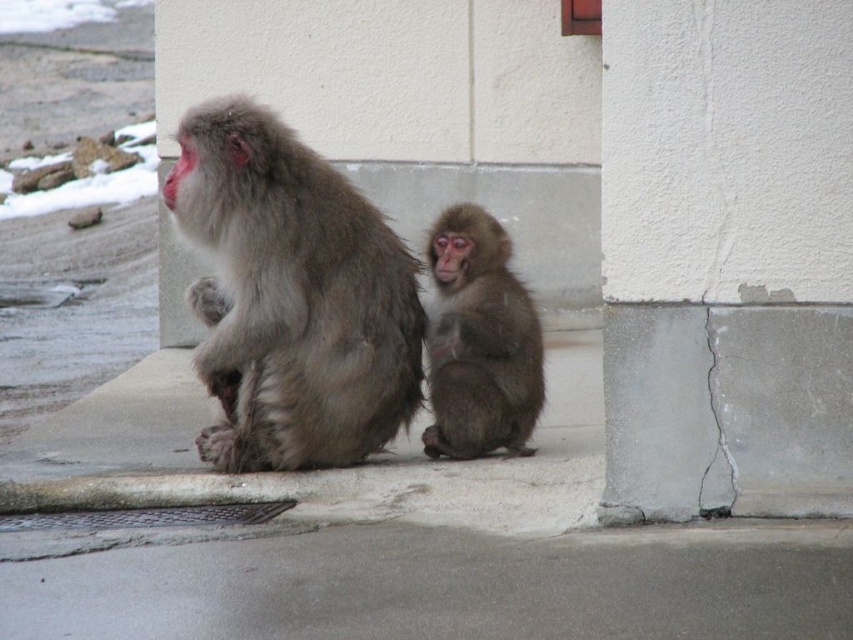
Is fuzzy gray fur monkey at center shorter than fuzzy brown monkey at center?

No.

Is fuzzy gray fur monkey at center bigger than fuzzy brown monkey at center?

Yes.

Who is more forward, [329,230] or [434,328]?

Positioned in front is point [329,230].

At what (x,y) coordinates should I click in order to perform the action: click on fuzzy gray fur monkey at center. Please return your answer as a coordinate pair (x, y). This screenshot has height=640, width=853. Looking at the image, I should click on (292, 296).

Consider the image. Does white concrete pillar at lower right lie behind fuzzy gray fur monkey at center?

That is False.

Is the position of white concrete pillar at lower right less distant than that of fuzzy gray fur monkey at center?

Yes, it is in front of fuzzy gray fur monkey at center.

What do you see at coordinates (727, 257) in the screenshot? I see `white concrete pillar at lower right` at bounding box center [727, 257].

Where is `white concrete pillar at lower right`? white concrete pillar at lower right is located at coordinates (727, 257).

What do you see at coordinates (727, 257) in the screenshot? I see `white concrete pillar at lower right` at bounding box center [727, 257].

Find the location of a particular element. The image size is (853, 640). white concrete pillar at lower right is located at coordinates (727, 257).